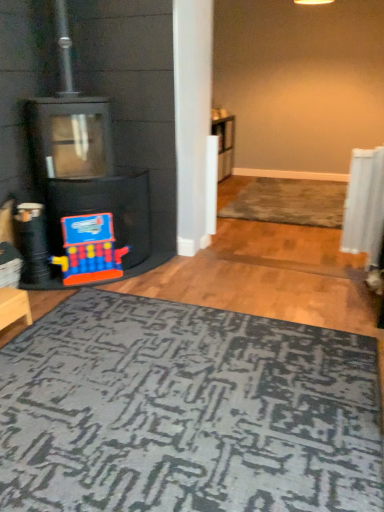
Question: Could you tell me if wooden stool at lower left is facing dark gray textured rug at lower center?

Choices:
 (A) yes
 (B) no

Answer: (A)

Question: Is wooden stool at lower left at the left side of dark gray textured rug at lower center?

Choices:
 (A) yes
 (B) no

Answer: (A)

Question: From the image's perspective, does wooden stool at lower left appear higher than dark gray textured rug at lower center?

Choices:
 (A) yes
 (B) no

Answer: (A)

Question: Can you confirm if wooden stool at lower left is positioned to the right of dark gray textured rug at lower center?

Choices:
 (A) no
 (B) yes

Answer: (A)

Question: Is wooden stool at lower left facing away from dark gray textured rug at lower center?

Choices:
 (A) yes
 (B) no

Answer: (B)

Question: From the image's perspective, relative to wooden stool at lower left, is rug with textured pattern at center above or below?

Choices:
 (A) above
 (B) below

Answer: (A)

Question: From a real-world perspective, is rug with textured pattern at center positioned above or below wooden stool at lower left?

Choices:
 (A) above
 (B) below

Answer: (B)

Question: Looking at their shapes, would you say rug with textured pattern at center is wider or thinner than wooden stool at lower left?

Choices:
 (A) thin
 (B) wide

Answer: (B)

Question: In the image, is rug with textured pattern at center on the left side or the right side of wooden stool at lower left?

Choices:
 (A) left
 (B) right

Answer: (B)

Question: From a real-world perspective, is black matte fireplace at left above or below dark gray textured rug at lower center?

Choices:
 (A) below
 (B) above

Answer: (B)

Question: In the image, is black matte fireplace at left positioned in front of or behind dark gray textured rug at lower center?

Choices:
 (A) behind
 (B) front

Answer: (A)

Question: From the image's perspective, relative to dark gray textured rug at lower center, is black matte fireplace at left above or below?

Choices:
 (A) below
 (B) above

Answer: (B)

Question: In the image, is black matte fireplace at left on the left side or the right side of dark gray textured rug at lower center?

Choices:
 (A) right
 (B) left

Answer: (B)

Question: Considering their positions, is black matte fireplace at left located in front of or behind matte plastic toy at lower left?

Choices:
 (A) behind
 (B) front

Answer: (B)

Question: Visually, is black matte fireplace at left positioned to the left or to the right of matte plastic toy at lower left?

Choices:
 (A) left
 (B) right

Answer: (A)